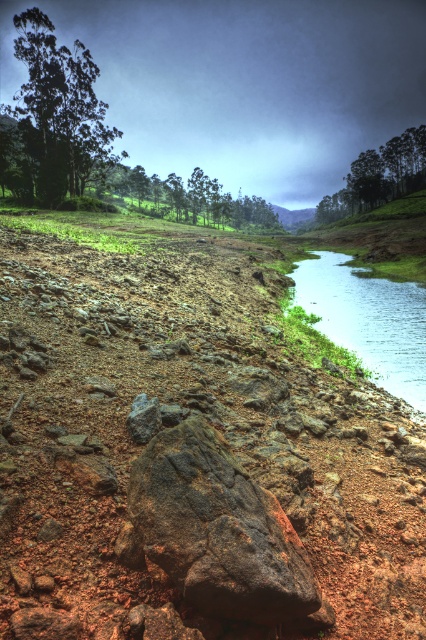
You are standing on the rugged, reddish brown soil and see the green leafy tree at upper left and the green matte tree at center. Which tree is located to the right of the other?

The green leafy tree at upper left is positioned on the left side of green matte tree at center, so the green matte tree at center is to the right of the green leafy tree at upper left.

In the scene shown: You are a hiker trying to determine which object is taller between the rusty metallic boulder at center and the green matte tree at upper right. Based on the scene, which one is taller?

The green matte tree at upper right is taller than the rusty metallic boulder at center.